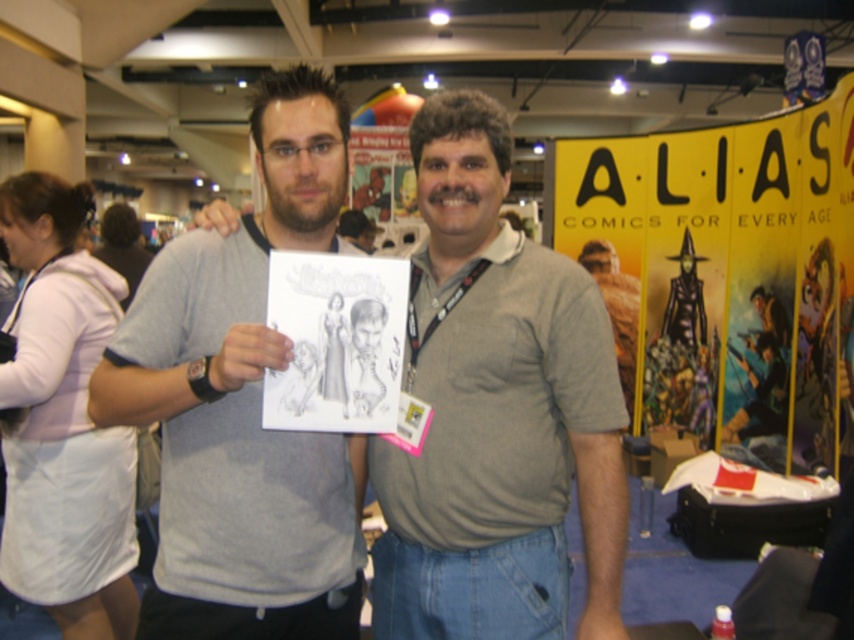
You are an attendee at the convention and want to take a photo of the graphite paper drawing at center. However, the gray cotton shirt at center is blocking your view. Can you see the drawing clearly from your current position?

The graphite paper drawing at center is behind the gray cotton shirt at center, so you cannot see it clearly from your current position.